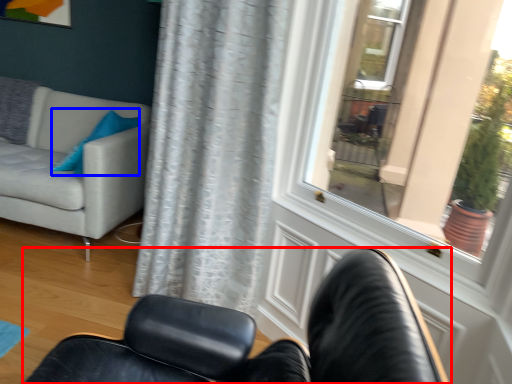
Question: Among these objects, which one is nearest to the camera, chair (highlighted by a red box) or pillow (highlighted by a blue box)?

Choices:
 (A) chair
 (B) pillow

Answer: (A)